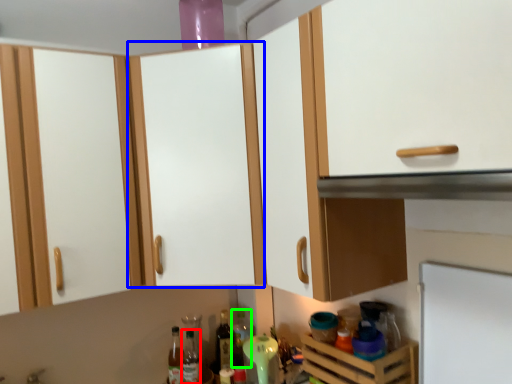
Question: Based on their relative distances, which object is nearer to bottle (highlighted by a red box)? Choose from cabinetry (highlighted by a blue box) and bottle (highlighted by a green box).

Choices:
 (A) cabinetry
 (B) bottle

Answer: (B)